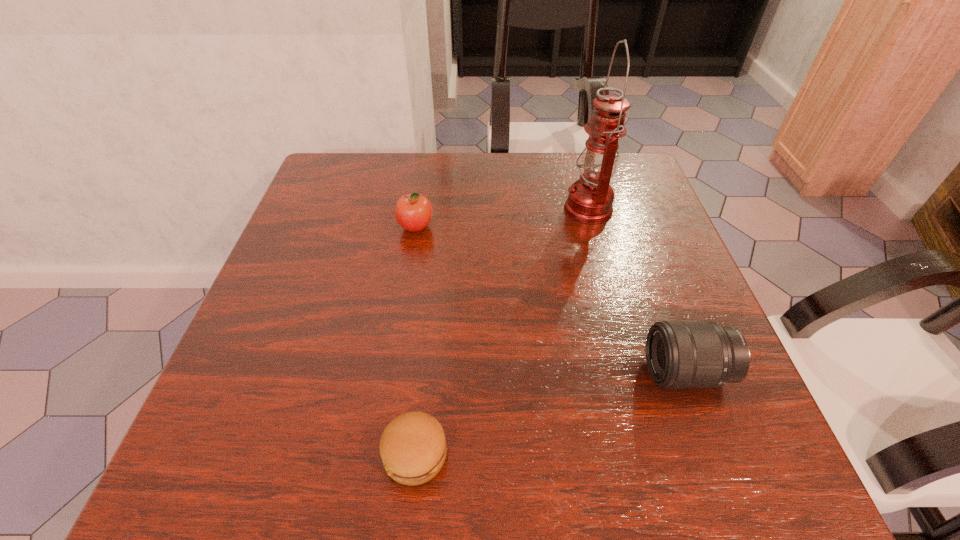
The image size is (960, 540). Find the location of `free space at the far left corner`. free space at the far left corner is located at coordinates (352, 204).

Find the location of a particular element. This screenshot has width=960, height=540. free space at the far right corner of the desktop is located at coordinates (636, 197).

What are the coordinates of `free space between the telephoto lens and the tallest object` in the screenshot? It's located at (637, 291).

Locate an element on the screen. vacant region between the oil lamp and the hamburger is located at coordinates (502, 332).

I want to click on free point between the telephoto lens and the oil lamp, so click(x=637, y=291).

This screenshot has height=540, width=960. I want to click on free spot between the telephoto lens and the oil lamp, so click(637, 291).

At what (x,y) coordinates should I click in order to perform the action: click on empty location between the hamburger and the telephoto lens. Please return your answer as a coordinate pair (x, y). This screenshot has width=960, height=540. Looking at the image, I should click on (551, 413).

The width and height of the screenshot is (960, 540). I want to click on vacant space that is in between the hamburger and the tallest object, so click(x=502, y=332).

Find the location of `free space between the tallest object and the telephoto lens`. free space between the tallest object and the telephoto lens is located at coordinates (637, 291).

Where is `free area in between the hamburger and the third farthest object`? This screenshot has height=540, width=960. free area in between the hamburger and the third farthest object is located at coordinates (551, 413).